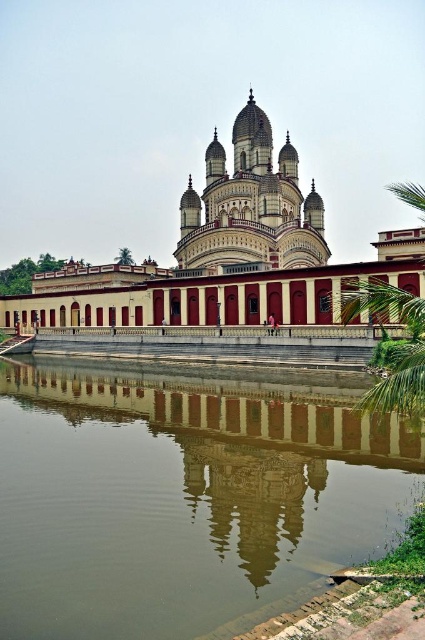
Is matte red building at center to the right of matte white temple at center from the viewer's perspective?

Incorrect, matte red building at center is not on the right side of matte white temple at center.

Who is taller, matte red building at center or matte white temple at center?

With more height is matte red building at center.

Is point (280, 268) closer to viewer compared to point (297, 195)?

Yes, point (280, 268) is closer to viewer.

This screenshot has width=425, height=640. Identify the location of matte red building at center. (226, 253).

Is brown concrete water at center smaller than matte white temple at center?

Indeed, brown concrete water at center has a smaller size compared to matte white temple at center.

I want to click on brown concrete water at center, so click(x=183, y=499).

Does brown concrete water at center have a smaller size compared to matte red building at center?

Correct, brown concrete water at center occupies less space than matte red building at center.

From the picture: Who is more distant from viewer, [345,516] or [397,260]?

Positioned behind is point [397,260].

Does point (36, 452) come closer to viewer compared to point (65, 316)?

Yes, it is in front of point (65, 316).

Find the location of a particular element. Image resolution: width=425 pixels, height=640 pixels. brown concrete water at center is located at coordinates (183, 499).